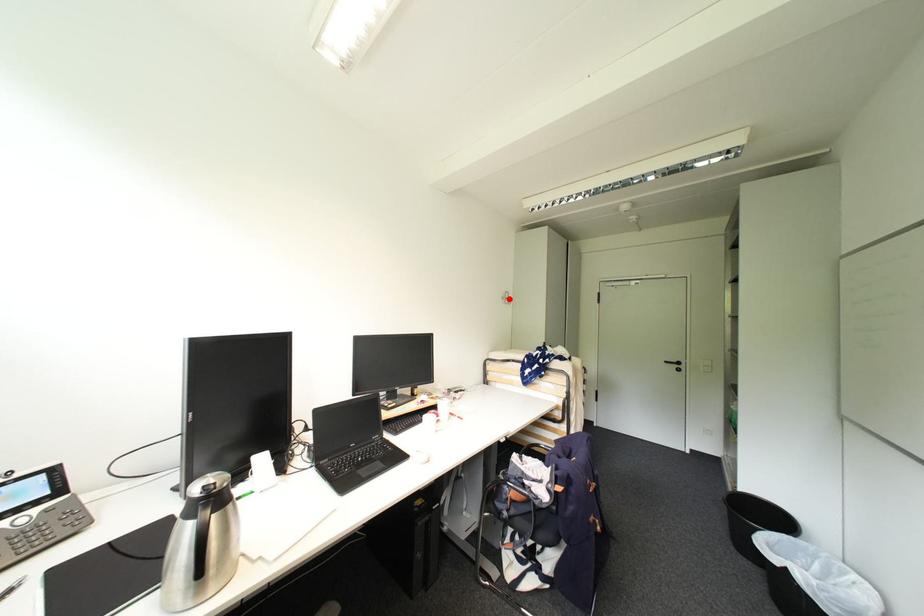
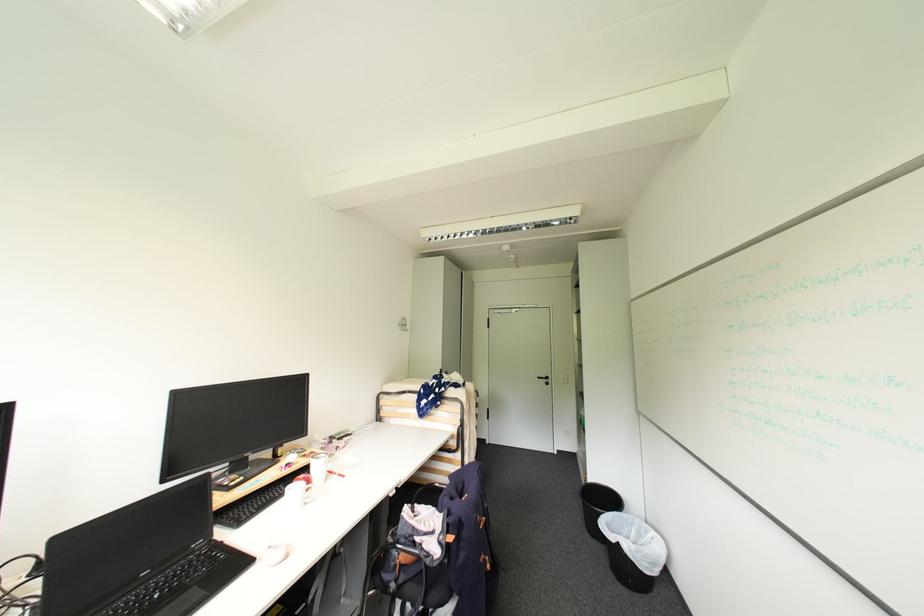
Find the pixel in the second image that matches the highlighted location in the first image.

(406, 325)